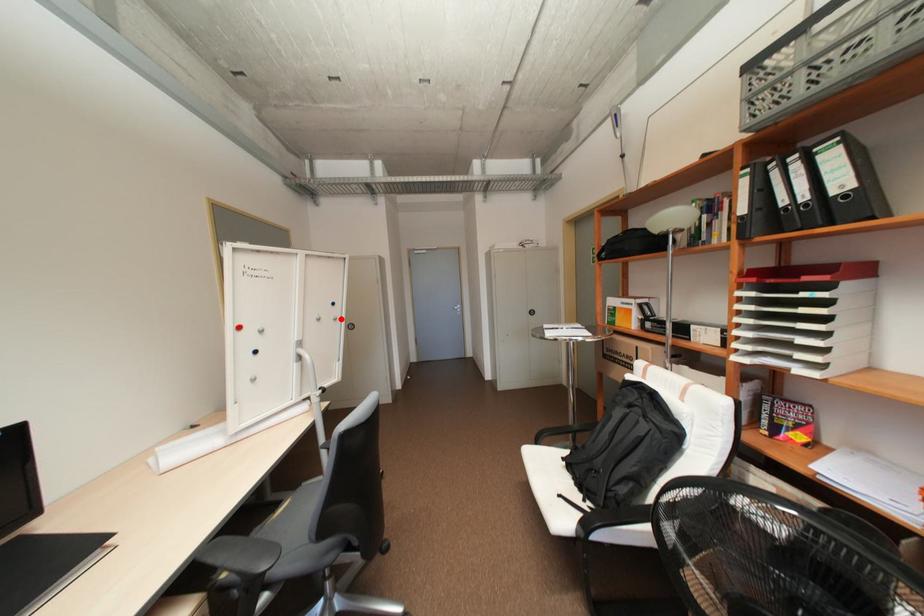
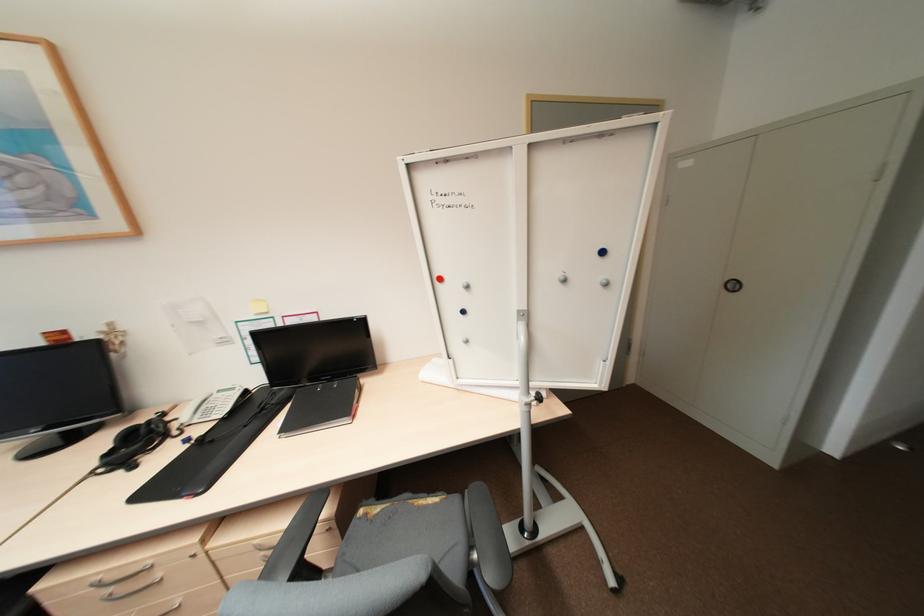
Question: I am providing you with two images of the same scene from different viewpoints. A red point is shown in image1. For the corresponding object point in image2, is it positioned nearer or farther from the camera?

Choices:
 (A) Nearer
 (B) Farther

Answer: (B)